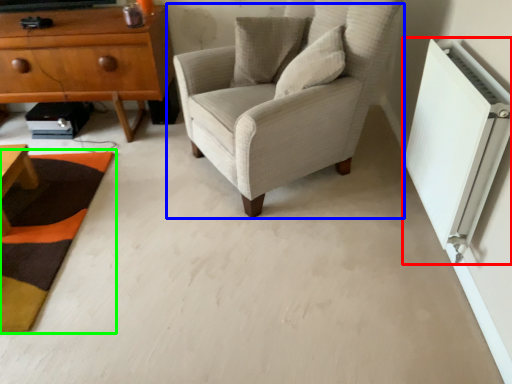
Question: Based on their relative distances, which object is nearer to air conditioning (highlighted by a red box)? Choose from chair (highlighted by a blue box) and mat (highlighted by a green box).

Choices:
 (A) chair
 (B) mat

Answer: (A)